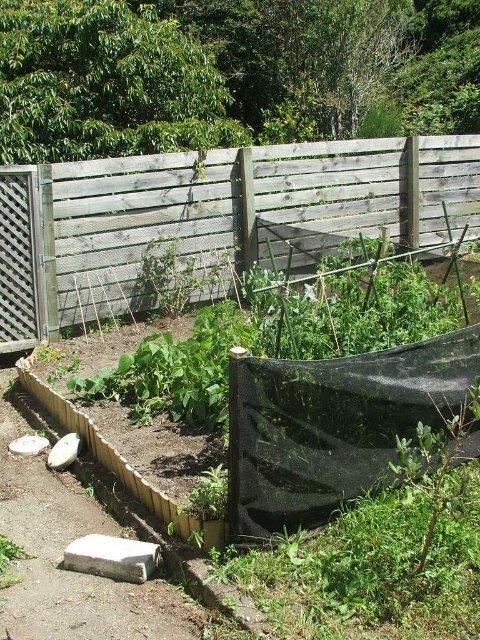
Question: Does wooden fence at upper center have a smaller size compared to brown dirt path at lower left?

Choices:
 (A) yes
 (B) no

Answer: (A)

Question: Is wooden fence at upper center wider than brown dirt path at lower left?

Choices:
 (A) yes
 (B) no

Answer: (B)

Question: Is wooden fence at upper center positioned in front of brown dirt path at lower left?

Choices:
 (A) yes
 (B) no

Answer: (B)

Question: Which point appears closest to the camera in this image?

Choices:
 (A) [311, 170]
 (B) [35, 557]

Answer: (B)